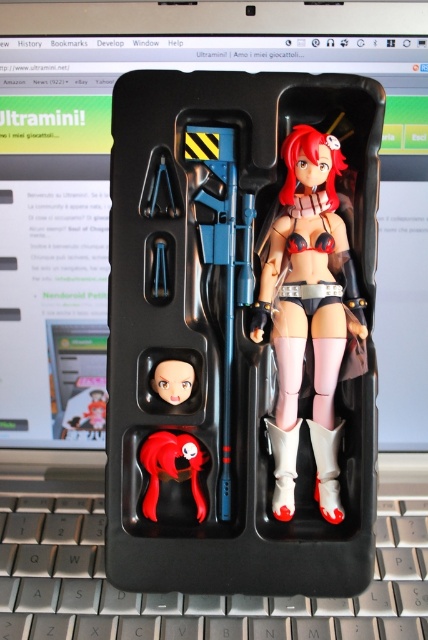
Does black plastic keyboard at lower center appear under satin black bikini at center?

Correct, black plastic keyboard at lower center is located below satin black bikini at center.

The height and width of the screenshot is (640, 428). In order to click on black plastic keyboard at lower center in this screenshot , I will do point(187,595).

Image resolution: width=428 pixels, height=640 pixels. What are the coordinates of `black plastic keyboard at lower center` in the screenshot? It's located at (187, 595).

Is point (181, 396) less distant than point (95, 394)?

Yes, it is.

Does point (175, 381) come behind point (83, 417)?

No, it is not.

This screenshot has width=428, height=640. In order to click on matte plastic head at lower left in this screenshot , I will do `click(172, 380)`.

Is black plastic keyboard at lower center shorter than matte red hair at center?

In fact, black plastic keyboard at lower center may be taller than matte red hair at center.

Locate an element on the screen. black plastic keyboard at lower center is located at coordinates (187, 595).